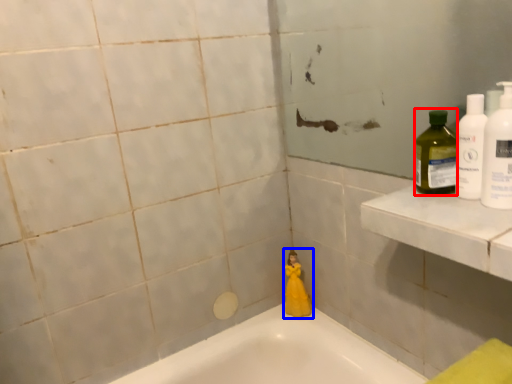
Question: Which object is closer to the camera taking this photo, cleaning product (highlighted by a red box) or toy (highlighted by a blue box)?

Choices:
 (A) cleaning product
 (B) toy

Answer: (A)